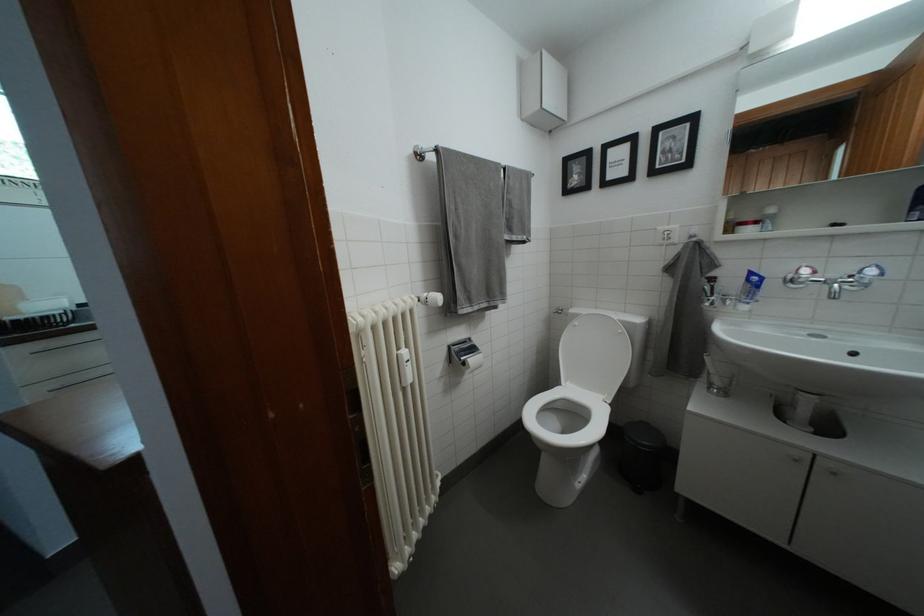
Find where to lift the black trash can. Please return your answer as a coordinate pair (x, y).

(641, 456)